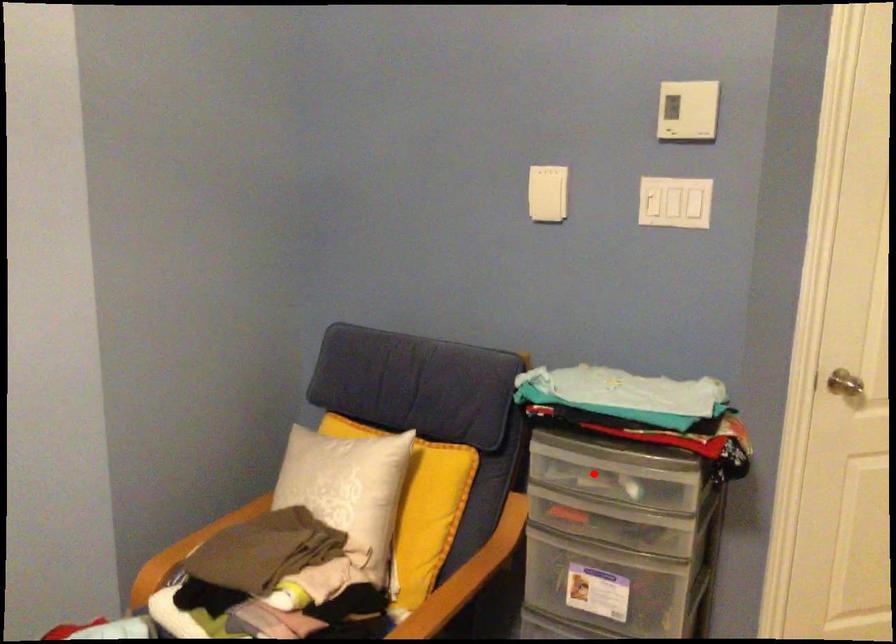
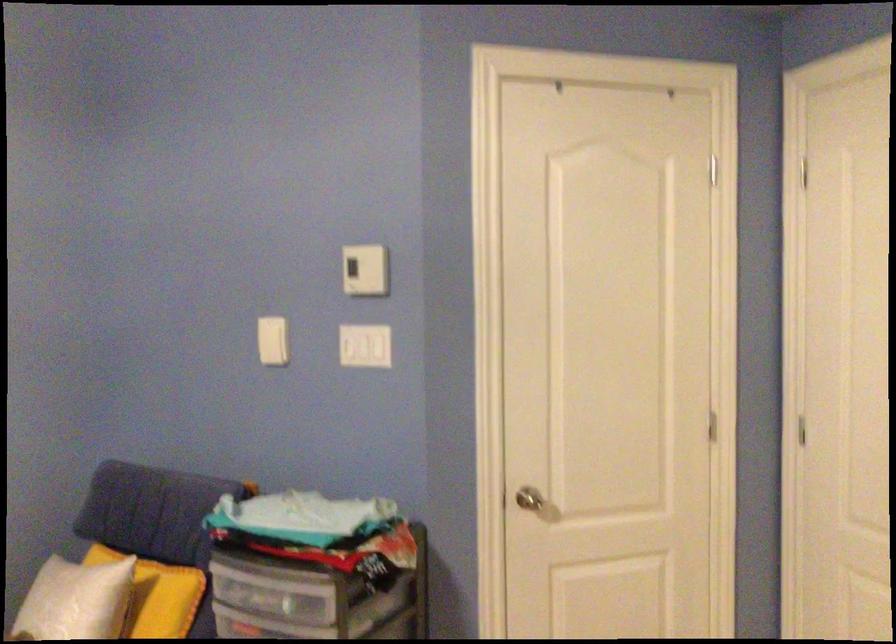
Find the pixel in the second image that matches the highlighted location in the first image.

(270, 592)